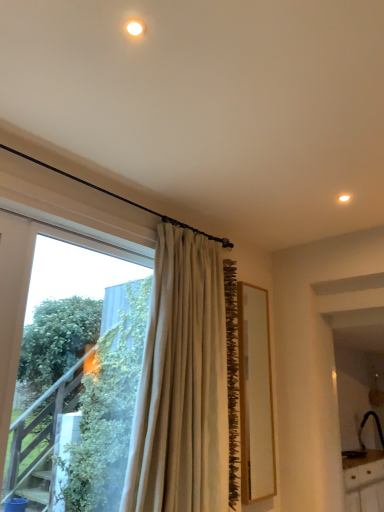
Question: Could you tell me if beige fabric curtain at center is turned towards black matte sink at lower right?

Choices:
 (A) yes
 (B) no

Answer: (B)

Question: Does beige fabric curtain at center have a lesser width compared to black matte sink at lower right?

Choices:
 (A) no
 (B) yes

Answer: (B)

Question: From the image's perspective, does beige fabric curtain at center appear lower than black matte sink at lower right?

Choices:
 (A) yes
 (B) no

Answer: (B)

Question: Is beige fabric curtain at center facing away from black matte sink at lower right?

Choices:
 (A) no
 (B) yes

Answer: (A)

Question: Is beige fabric curtain at center positioned far away from black matte sink at lower right?

Choices:
 (A) no
 (B) yes

Answer: (B)

Question: Based on their sizes in the image, would you say black matte sink at lower right is bigger or smaller than transparent glass window at left?

Choices:
 (A) small
 (B) big

Answer: (B)

Question: From a real-world perspective, is black matte sink at lower right above or below transparent glass window at left?

Choices:
 (A) above
 (B) below

Answer: (B)

Question: Considering the relative positions of black matte sink at lower right and transparent glass window at left in the image provided, is black matte sink at lower right to the left or to the right of transparent glass window at left?

Choices:
 (A) right
 (B) left

Answer: (A)

Question: Does point (377, 421) appear closer or farther from the camera than point (29, 311)?

Choices:
 (A) closer
 (B) farther

Answer: (B)

Question: From the image's perspective, relative to transparent glass window at left, is beige fabric curtain at center above or below?

Choices:
 (A) below
 (B) above

Answer: (A)

Question: Is beige fabric curtain at center taller or shorter than transparent glass window at left?

Choices:
 (A) tall
 (B) short

Answer: (A)

Question: From a real-world perspective, relative to transparent glass window at left, is beige fabric curtain at center vertically above or below?

Choices:
 (A) above
 (B) below

Answer: (A)

Question: Is point (142, 398) positioned closer to the camera than point (39, 256)?

Choices:
 (A) farther
 (B) closer

Answer: (B)

Question: Does point (379, 420) appear closer or farther from the camera than point (192, 501)?

Choices:
 (A) closer
 (B) farther

Answer: (B)

Question: From the image's perspective, is black matte sink at lower right positioned above or below beige fabric curtain at center?

Choices:
 (A) below
 (B) above

Answer: (A)